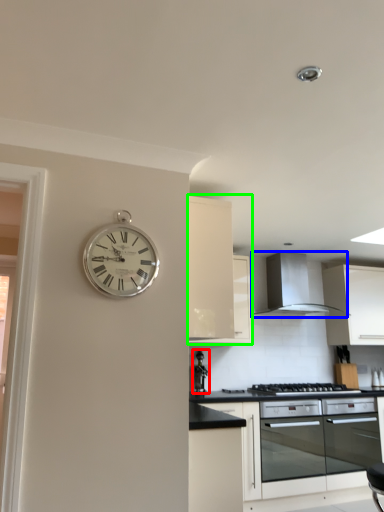
Question: Which is farther away from appliance (highlighted by a red box)? exhaust hood (highlighted by a blue box) or cabinetry (highlighted by a green box)?

Choices:
 (A) exhaust hood
 (B) cabinetry

Answer: (B)